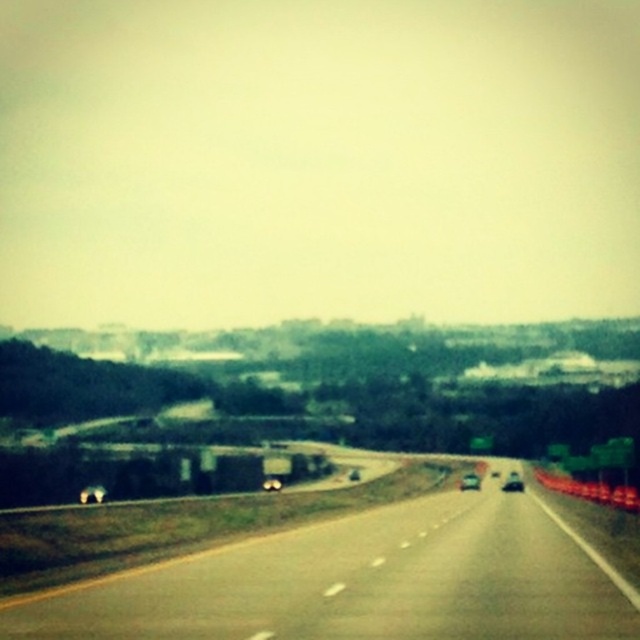
You are a driver who wants to safely pass the black glossy car at center on the asphalt road at center. Based on the road and car widths, can you estimate if there is enough space to change lanes without crossing the solid yellow line?

The asphalt road at center might be wider than black glossy car at center, so there might be enough space to change lanes safely without crossing the solid yellow line.

You are a photographer trying to capture a detailed shot of two points on the highway. The first point is at coordinates point [232,625] and the second is at point [512,490]. Based on the scene, which point would appear larger in your photo?

Point [232,625] would appear larger in the photo because it is closer to the camera than point [512,490].

In the scene shown: You are a driver who wants to stay on the asphalt road at center. What coordinates should you aim for to stay on the road?

You should aim for the coordinates point (356, 582) to stay on the asphalt road at center.